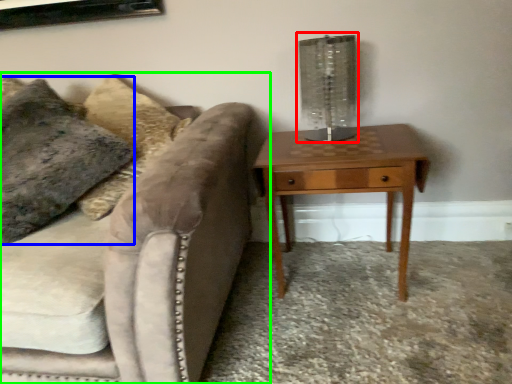
Question: Which object is the farthest from table lamp (highlighted by a red box)? Choose among these: pillow (highlighted by a blue box) or studio couch (highlighted by a green box).

Choices:
 (A) pillow
 (B) studio couch

Answer: (A)